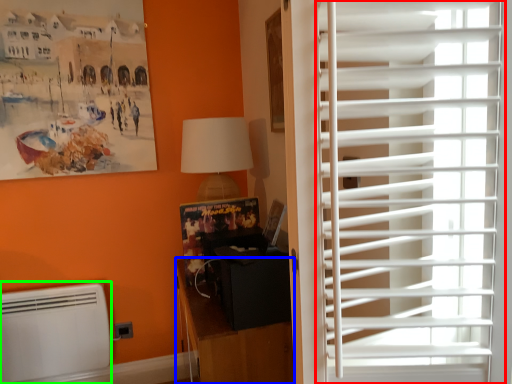
Question: Based on their relative distances, which object is farther from window blind (highlighted by a red box)? Choose from furniture (highlighted by a blue box) and air conditioning (highlighted by a green box).

Choices:
 (A) furniture
 (B) air conditioning

Answer: (B)